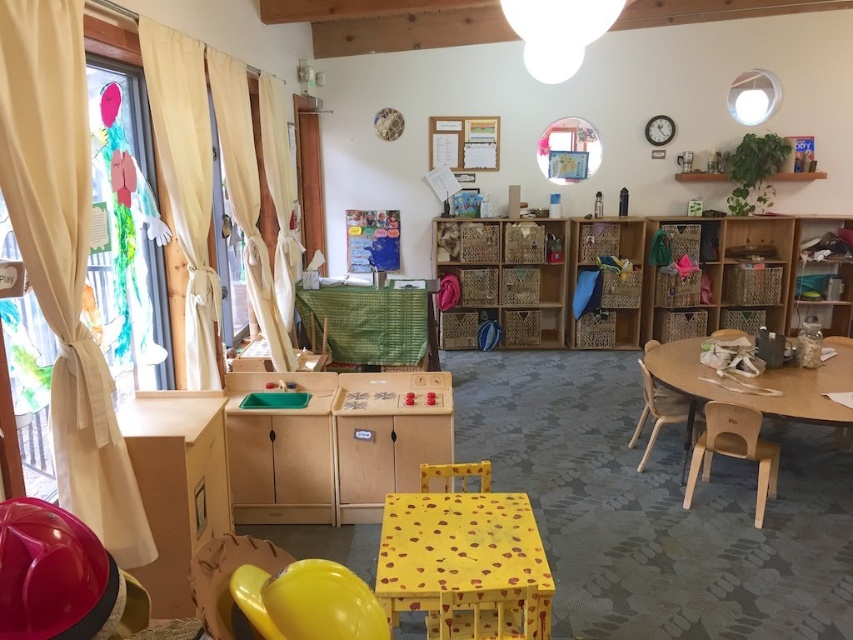
Is wooden table at right above wooden chair at right?

Yes.

Is wooden table at right smaller than wooden chair at right?

Actually, wooden table at right might be larger than wooden chair at right.

At what (x,y) coordinates should I click in order to perform the action: click on wooden table at right. Please return your answer as a coordinate pair (x, y). Looking at the image, I should click on (753, 387).

Who is positioned more to the right, woven basket at center or wooden table at right?

From the viewer's perspective, wooden table at right appears more on the right side.

Looking at this image, does woven basket at center have a larger size compared to wooden table at right?

No, woven basket at center is not bigger than wooden table at right.

Measure the distance between woven basket at center and camera.

woven basket at center and camera are 6.17 meters apart from each other.

Find the location of a particular element. woven basket at center is located at coordinates (503, 280).

Based on the photo, is woven basket at center positioned at the back of wooden chair at center?

Yes, woven basket at center is further from the viewer.

Between woven basket at center and wooden chair at center, which one has less height?

Standing shorter between the two is wooden chair at center.

Between point (521, 260) and point (732, 328), which one is positioned in front?

Point (521, 260) is in front.

Identify the location of woven basket at center. This screenshot has height=640, width=853. pos(503,280).